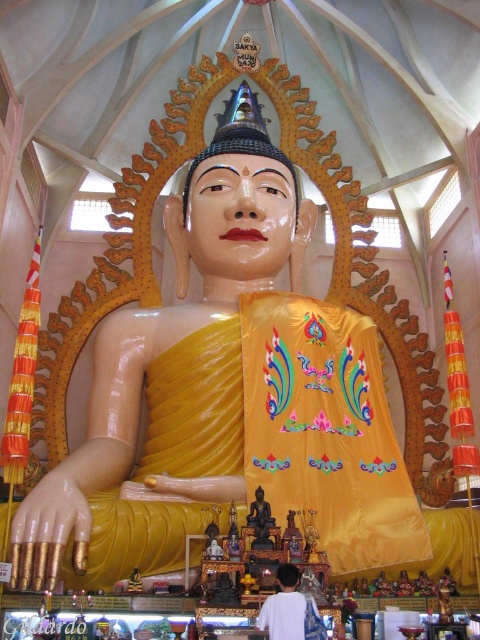
How much distance is there between white fabric at lower center and black glossy statue at center?

The distance of white fabric at lower center from black glossy statue at center is 7.21 meters.

Which is behind, point (268, 634) or point (263, 534)?

The point (263, 534) is more distant.

Image resolution: width=480 pixels, height=640 pixels. In order to click on white fabric at lower center in this screenshot , I will do `click(285, 608)`.

Does matte gold statue at center have a greater width compared to white fabric at lower center?

Correct, the width of matte gold statue at center exceeds that of white fabric at lower center.

Which is in front, point (301, 307) or point (271, 621)?

Point (271, 621) is in front.

Which is in front, point (178, 342) or point (300, 596)?

Point (300, 596)

This screenshot has width=480, height=640. I want to click on matte gold statue at center, so click(x=227, y=394).

Does matte gold statue at center appear on the right side of black glossy statue at center?

Yes, matte gold statue at center is to the right of black glossy statue at center.

What do you see at coordinates (227, 394) in the screenshot? This screenshot has height=640, width=480. I see `matte gold statue at center` at bounding box center [227, 394].

Locate an element on the screen. The height and width of the screenshot is (640, 480). matte gold statue at center is located at coordinates (227, 394).